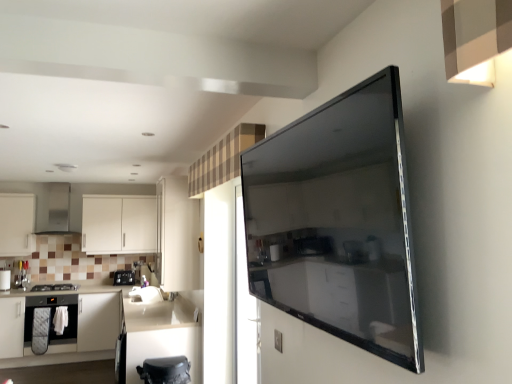
Find the location of `black glass stove at left, acting as the 3th appliance starting from the right`. black glass stove at left, acting as the 3th appliance starting from the right is located at coordinates (5, 280).

Where is `white plastic electric outlet at upper center`? This screenshot has height=384, width=512. white plastic electric outlet at upper center is located at coordinates (278, 341).

The width and height of the screenshot is (512, 384). In order to click on white matte cabinet at lower left, the fourth cabinetry when ordered from front to back in this screenshot , I will do `click(65, 329)`.

I want to click on white matte cabinetry at left, which ranks as the sixth cabinetry in back-to-front order, so click(x=112, y=329).

Find the location of a particular element. black glass stove at left, which ranks as the 2th appliance in front-to-back order is located at coordinates (5, 280).

Do you think white glossy sink at lower center is within matte black oven at left, arranged as the 1th home appliance when ordered from the bottom, or outside of it?

white glossy sink at lower center cannot be found inside matte black oven at left, arranged as the 1th home appliance when ordered from the bottom.

Can you tell me how much white glossy sink at lower center and matte black oven at left, arranged as the second home appliance when viewed from the top, differ in facing direction?

There is a 90.1-degree angle between the facing directions of white glossy sink at lower center and matte black oven at left, arranged as the second home appliance when viewed from the top.

Is white glossy sink at lower center to the left of matte black oven at left, arranged as the 1th home appliance when ordered from the bottom, from the viewer's perspective?

Incorrect, white glossy sink at lower center is not on the left side of matte black oven at left, arranged as the 1th home appliance when ordered from the bottom.

Does white glossy sink at lower center have a greater width compared to matte black oven at left, arranged as the 1th home appliance when ordered from the bottom?

No, white glossy sink at lower center is not wider than matte black oven at left, arranged as the 1th home appliance when ordered from the bottom.

Is transparent glass door at center at the back of white matte cabinet at left, positioned as the second cabinetry in back-to-front order?

No, white matte cabinet at left, positioned as the second cabinetry in back-to-front order, is not facing away from transparent glass door at center.

Is white matte cabinet at left, positioned as the second cabinetry in back-to-front order, positioned beyond the bounds of transparent glass door at center?

That's correct, white matte cabinet at left, positioned as the second cabinetry in back-to-front order, is outside of transparent glass door at center.

Does white matte cabinet at left, positioned as the second cabinetry in back-to-front order, have a lesser height compared to transparent glass door at center?

Correct, white matte cabinet at left, positioned as the second cabinetry in back-to-front order, is not as tall as transparent glass door at center.

Identify the location of the 2nd cabinetry positioned above the transparent glass door at center (from the image's perspective). (17, 224).

Is black plastic toaster at left facing towards white glossy cabinet at lower center, the 5th cabinetry in the back-to-front sequence?

Yes, black plastic toaster at left is facing white glossy cabinet at lower center, the 5th cabinetry in the back-to-front sequence.

From a real-world perspective, is black plastic toaster at left beneath white glossy cabinet at lower center, the 5th cabinetry in the back-to-front sequence?

No, from a real-world perspective, black plastic toaster at left is not beneath white glossy cabinet at lower center, the 5th cabinetry in the back-to-front sequence.

Which object is positioned more to the left, black plastic toaster at left or white glossy cabinet at lower center, which ranks as the second cabinetry in front-to-back order?

black plastic toaster at left is more to the left.

Could you tell me if white matte cabinet at upper left, which appears as the sixth cabinetry when viewed from the front, is turned towards white matte cabinet at left, positioned as the second cabinetry in back-to-front order?

No, white matte cabinet at upper left, which appears as the sixth cabinetry when viewed from the front, is not aimed at white matte cabinet at left, positioned as the second cabinetry in back-to-front order.

Is white matte cabinet at upper left, which appears as the sixth cabinetry when viewed from the front, positioned far away from white matte cabinet at left, positioned as the second cabinetry in back-to-front order?

Yes, white matte cabinet at upper left, which appears as the sixth cabinetry when viewed from the front, is far from white matte cabinet at left, positioned as the second cabinetry in back-to-front order.

Based on the photo, relative to white matte cabinet at left, placed as the 5th cabinetry when sorted from front to back, is white matte cabinet at upper left, the 1th cabinetry from the back, in front or behind?

Clearly, white matte cabinet at upper left, the 1th cabinetry from the back, is behind white matte cabinet at left, placed as the 5th cabinetry when sorted from front to back.

Does point (112, 229) come in front of point (24, 209)?

No, (112, 229) is behind (24, 209).

Consider the image. What's the angular difference between brushed metal knife block at left, which ranks as the 1th appliance in back-to-front order, and stainless steel exhaust hood at left's facing directions?

brushed metal knife block at left, which ranks as the 1th appliance in back-to-front order, and stainless steel exhaust hood at left are facing 1.27 degrees away from each other.

You are a GUI agent. You are given a task and a screenshot of the screen. Output one action in this format:
    pyautogui.click(x=<x>, y=<y>)
    Task: Click on the exhaust hood located in front of the brushed metal knife block at left, marked as the 2th appliance in a left-to-right arrangement
    This screenshot has width=512, height=384.
    Given the screenshot: What is the action you would take?
    pyautogui.click(x=58, y=209)

Is point (17, 287) closer or farther from the camera than point (57, 211)?

Clearly, point (17, 287) is closer to the camera than point (57, 211).

Is brushed metal knife block at left, marked as the 2th appliance in a left-to-right arrangement, not near stainless steel exhaust hood at left?

They are positioned close to each other.

Considering the positions of objects transparent glass door at center and white matte cabinet at upper left, which appears as the sixth cabinetry when viewed from the front, in the image provided, who is more to the right, transparent glass door at center or white matte cabinet at upper left, which appears as the sixth cabinetry when viewed from the front,?

From the viewer's perspective, transparent glass door at center appears more on the right side.

Based on the photo, which of these two, transparent glass door at center or white matte cabinet at upper left, the 1th cabinetry from the back, is bigger?

With larger size is white matte cabinet at upper left, the 1th cabinetry from the back.

Choose the correct answer: Is transparent glass door at center inside white matte cabinet at upper left, which appears as the sixth cabinetry when viewed from the front, or outside it?

transparent glass door at center is not inside white matte cabinet at upper left, which appears as the sixth cabinetry when viewed from the front, it's outside.

At what (x,y) coordinates should I click in order to perform the action: click on cabinetry that is the 1st one when counting upward from the transparent glass door at center (from the image's perspective). Please return your answer as a coordinate pair (x, y). This screenshot has height=384, width=512. Looking at the image, I should click on (119, 224).

Considering the sizes of objects stainless steel exhaust hood at left and white plastic electric outlet at upper center in the image provided, who is bigger, stainless steel exhaust hood at left or white plastic electric outlet at upper center?

stainless steel exhaust hood at left is bigger.

Can you tell me how much stainless steel exhaust hood at left and white plastic electric outlet at upper center differ in facing direction?

The facing directions of stainless steel exhaust hood at left and white plastic electric outlet at upper center are 88.6 degrees apart.

Considering the sizes of objects stainless steel exhaust hood at left and white plastic electric outlet at upper center in the image provided, who is taller, stainless steel exhaust hood at left or white plastic electric outlet at upper center?

stainless steel exhaust hood at left is taller.

Considering their positions, is stainless steel exhaust hood at left located in front of or behind white plastic electric outlet at upper center?

stainless steel exhaust hood at left is behind white plastic electric outlet at upper center.

The image size is (512, 384). I want to click on sink above the matte black oven at left, arranged as the 1th home appliance when ordered from the bottom (from the image's perspective), so click(145, 295).

Find the location of a particular element. the 5th cabinetry behind the transparent glass door at center, counting from the anchor's position is located at coordinates (17, 224).

Based on their spatial positions, is white matte cabinet at left, which is the 3th cabinetry in front-to-back order, or black matte toaster at lower center, placed as the 3th appliance when sorted from left to right, closer to white plastic electric outlet at upper center?

black matte toaster at lower center, placed as the 3th appliance when sorted from left to right, is positioned closer to the anchor white plastic electric outlet at upper center.

When comparing their distances from brushed metal knife block at left, which ranks as the 1th appliance in back-to-front order, does white plastic electric outlet at upper center or stainless steel exhaust hood at left seem further?

white plastic electric outlet at upper center lies further to brushed metal knife block at left, which ranks as the 1th appliance in back-to-front order, than the other object.

From the image, which object appears to be nearer to black plastic toaster at left, white matte cabinet at upper left, which appears as the sixth cabinetry when viewed from the front, or satin black oven at left, placed as the 1th home appliance when sorted from top to bottom?

white matte cabinet at upper left, which appears as the sixth cabinetry when viewed from the front, is positioned closer to the anchor black plastic toaster at left.

Estimate the real-world distances between objects in this image. Which object is further from white matte cabinet at left, the 4th cabinetry when ordered from back to front, white matte cabinet at lower left, the fourth cabinetry when ordered from front to back, or matte black oven at left, arranged as the second home appliance when viewed from the top?

Based on the image, matte black oven at left, arranged as the second home appliance when viewed from the top, appears to be further to white matte cabinet at left, the 4th cabinetry when ordered from back to front.

Based on their spatial positions, is transparent glass door at center or black glass stove at left, the 2th appliance from the back, closer to brushed metal knife block at left, marked as the 2th appliance in a left-to-right arrangement?

Among the two, black glass stove at left, the 2th appliance from the back, is located nearer to brushed metal knife block at left, marked as the 2th appliance in a left-to-right arrangement.

Estimate the real-world distances between objects in this image. Which object is closer to white glossy sink at lower center, white matte cabinet at left, placed as the 5th cabinetry when sorted from front to back, or black plastic toaster at left?

black plastic toaster at left.

Estimate the real-world distances between objects in this image. Which object is closer to brushed metal knife block at left, which is the 2th appliance from right to left, white plastic electric outlet at upper center or matte black oven at left, arranged as the second home appliance when viewed from the top?

Based on the image, matte black oven at left, arranged as the second home appliance when viewed from the top, appears to be nearer to brushed metal knife block at left, which is the 2th appliance from right to left.

Looking at the image, which one is located further to black plastic toaster at left, white plastic electric outlet at upper center or matte black oven at left, arranged as the second home appliance when viewed from the top?

Among the two, white plastic electric outlet at upper center is located further to black plastic toaster at left.

In order to click on exhaust hood between white matte cabinet at left, placed as the 5th cabinetry when sorted from front to back, and white matte cabinet at upper left, which appears as the sixth cabinetry when viewed from the front in this screenshot , I will do `click(58, 209)`.

Where is `sink situated between black glass stove at left, the 1th appliance from the left, and transparent glass door at center from left to right`? The height and width of the screenshot is (384, 512). sink situated between black glass stove at left, the 1th appliance from the left, and transparent glass door at center from left to right is located at coordinates (145, 295).

You are a GUI agent. You are given a task and a screenshot of the screen. Output one action in this format:
    pyautogui.click(x=<x>, y=<y>)
    Task: Click on the kitchen appliance located between stainless steel exhaust hood at left and white glossy sink at lower center in the left-right direction
    The width and height of the screenshot is (512, 384).
    Given the screenshot: What is the action you would take?
    pyautogui.click(x=124, y=277)

At what (x,y) coordinates should I click in order to perform the action: click on sink positioned between transparent glass door at center and black plastic toaster at left from near to far. Please return your answer as a coordinate pair (x, y). This screenshot has width=512, height=384. Looking at the image, I should click on (145, 295).